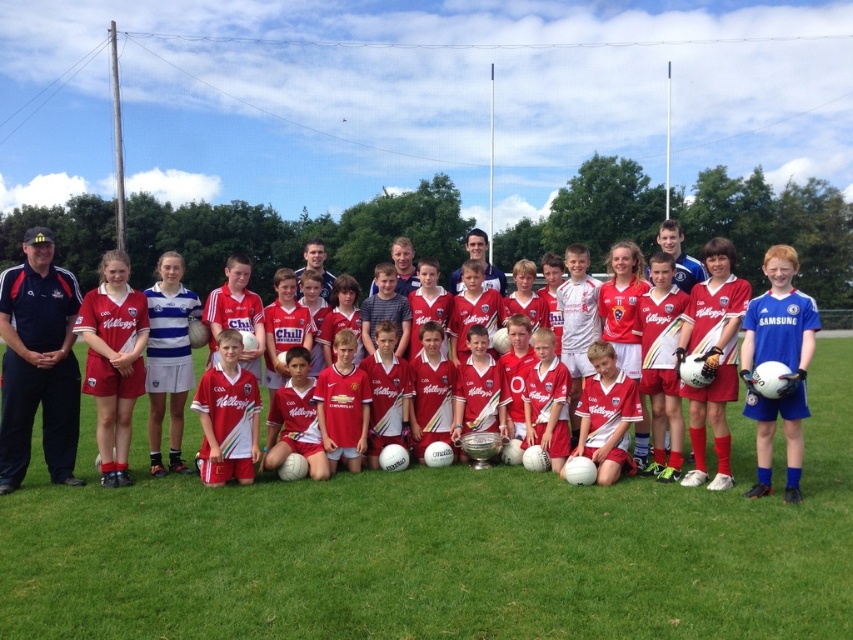
Can you confirm if dark blue uniform at left is bigger than smooth red jersey at center?

No, dark blue uniform at left is not bigger than smooth red jersey at center.

I want to click on dark blue uniform at left, so click(x=38, y=364).

Is point (73, 387) positioned before point (486, 237)?

Yes, it is.

The width and height of the screenshot is (853, 640). Identify the location of dark blue uniform at left. (38, 364).

In the scene shown: Which is more to the left, smooth red jersey at center or smooth white jersey at center?

Positioned to the left is smooth white jersey at center.

Is point (486, 266) closer to viewer compared to point (311, 260)?

No, it is behind (311, 260).

This screenshot has width=853, height=640. Identify the location of smooth red jersey at center. (485, 260).

Can you confirm if green grass football field at center is taller than red matte jersey at center?

No.

Between green grass football field at center and red matte jersey at center, which one is positioned lower?

Positioned lower is green grass football field at center.

Is point (233, 596) positioned in front of point (790, 250)?

That is True.

Find the location of a particular element. The height and width of the screenshot is (640, 853). green grass football field at center is located at coordinates (445, 550).